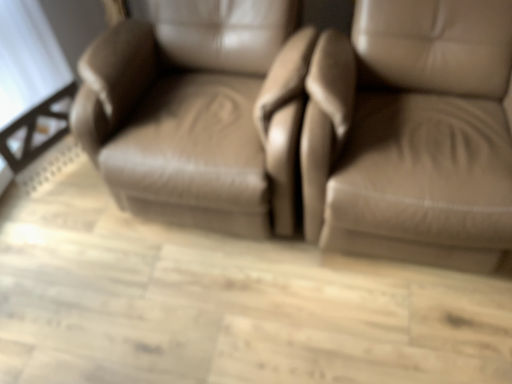
Question: In terms of size, does matte leather chair at center, positioned as the first chair in left-to-right order, appear bigger or smaller than matte leather chair at right, which is the 2th chair in left-to-right order?

Choices:
 (A) big
 (B) small

Answer: (B)

Question: Is matte leather chair at center, the second chair when ordered from right to left, inside the boundaries of matte leather chair at right, placed as the first chair when sorted from right to left, or outside?

Choices:
 (A) outside
 (B) inside

Answer: (A)

Question: In the image, is matte leather chair at center, the second chair when ordered from right to left, positioned in front of or behind matte leather chair at right, which is the 2th chair in left-to-right order?

Choices:
 (A) front
 (B) behind

Answer: (B)

Question: Is matte leather chair at right, placed as the first chair when sorted from right to left, taller or shorter than matte leather chair at center, positioned as the first chair in left-to-right order?

Choices:
 (A) short
 (B) tall

Answer: (B)

Question: From a real-world perspective, is matte leather chair at right, which is the 2th chair in left-to-right order, positioned above or below matte leather chair at center, the second chair when ordered from right to left?

Choices:
 (A) above
 (B) below

Answer: (A)

Question: Considering the positions of matte leather chair at right, which is the 2th chair in left-to-right order, and matte leather chair at center, positioned as the first chair in left-to-right order, in the image, is matte leather chair at right, which is the 2th chair in left-to-right order, bigger or smaller than matte leather chair at center, positioned as the first chair in left-to-right order,?

Choices:
 (A) small
 (B) big

Answer: (B)

Question: In the image, is matte leather chair at right, placed as the first chair when sorted from right to left, on the left side or the right side of matte leather chair at center, positioned as the first chair in left-to-right order?

Choices:
 (A) right
 (B) left

Answer: (A)